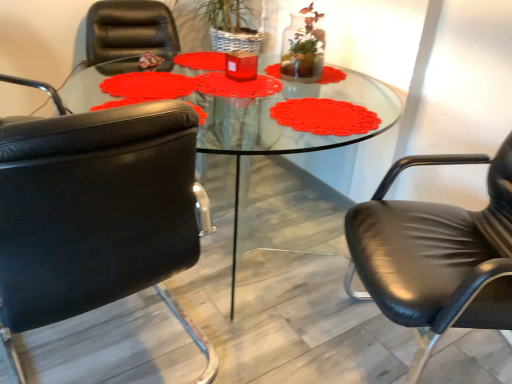
Locate an element on the screen. The image size is (512, 384). free area below black leather chair at left, the 2th chair in the right-to-left sequence (from a real-world perspective) is located at coordinates (84, 349).